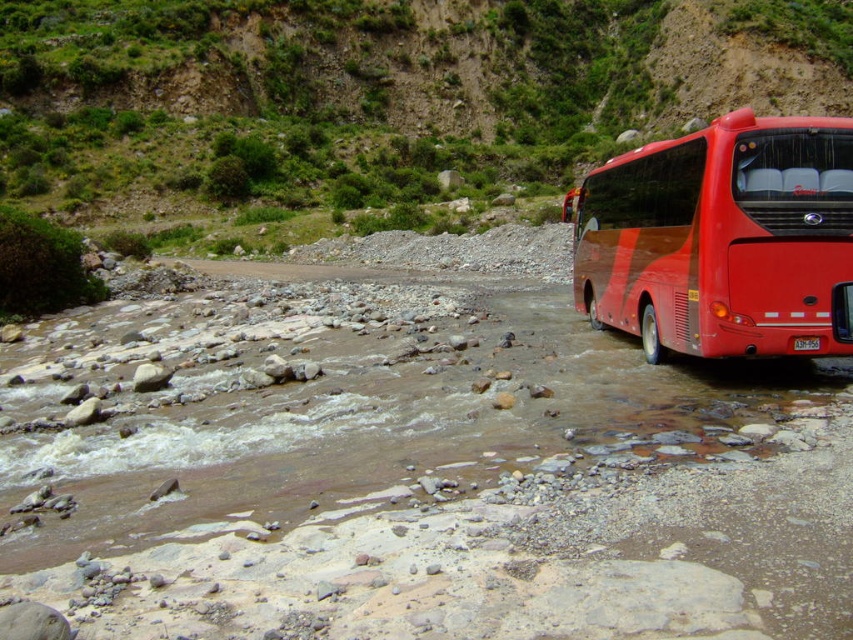
You are standing at point (351, 266) and want to walk to the red bus. Which direction should you move relative to point (210, 172)?

You should move towards point (210, 172) because it is behind point (351, 266), meaning the direction towards the red bus would be in the same direction as point (210, 172) relative to your current position.

You are a hiker trying to cross the riverbed. The green grassy hillside at upper center and the red glossy bus at right are in your line of sight. Which object is wider from your perspective?

The green grassy hillside at upper center is wider than the red glossy bus at right.